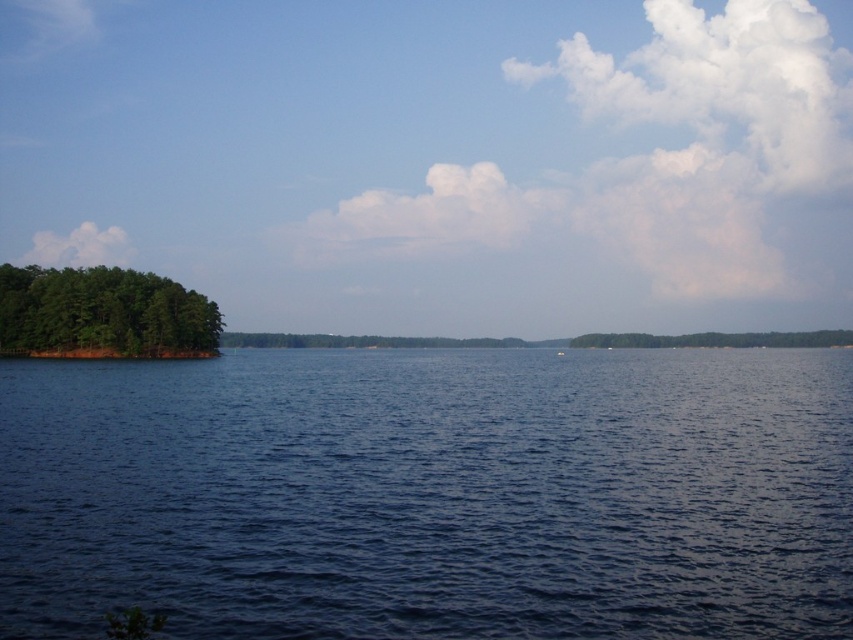
Question: Which object appears farthest from the camera in this image?

Choices:
 (A) white plastic boat at center
 (B) white fluffy cloud at upper right
 (C) green matte tree at center

Answer: (B)

Question: Does dark blue water at center lie in front of white plastic boat at center?

Choices:
 (A) no
 (B) yes

Answer: (B)

Question: Does green matte tree at center have a larger size compared to white fluffy cloud at upper left?

Choices:
 (A) yes
 (B) no

Answer: (A)

Question: Which object is the farthest from the white plastic boat at center?

Choices:
 (A) white fluffy cloud at upper left
 (B) green matte tree at center

Answer: (A)

Question: Considering the relative positions of white fluffy cloud at upper right and green matte trees at left in the image provided, where is white fluffy cloud at upper right located with respect to green matte trees at left?

Choices:
 (A) right
 (B) left

Answer: (A)

Question: Estimate the real-world distances between objects in this image. Which object is closer to the green matte trees at left?

Choices:
 (A) white fluffy cloud at upper right
 (B) white fluffy cloud at upper left
 (C) white fluffy cloud at upper center

Answer: (C)